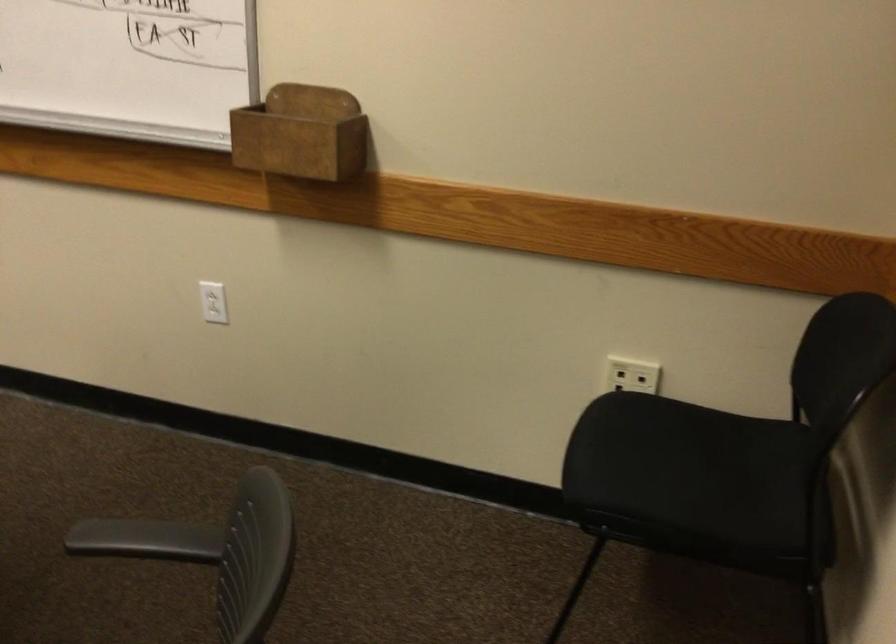
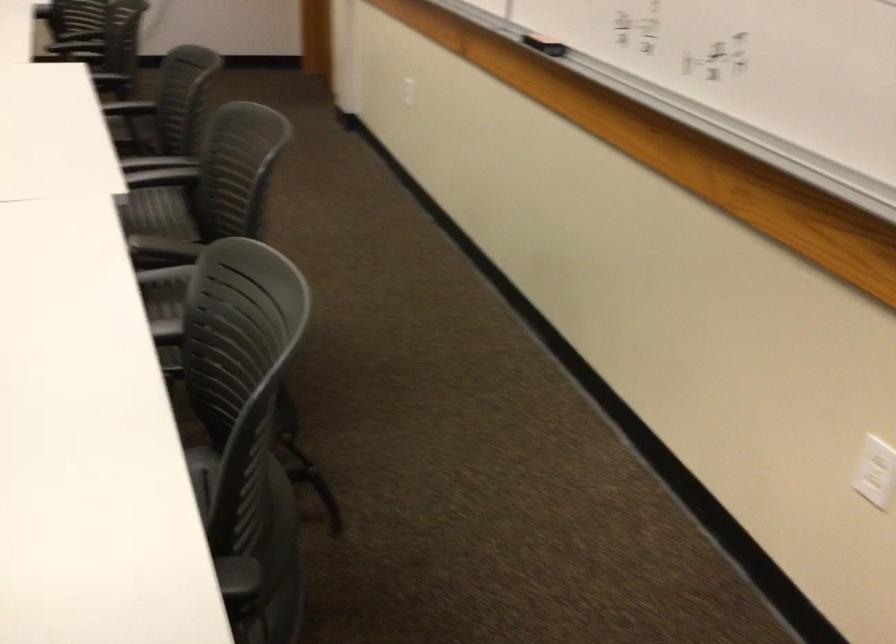
Question: The camera is either moving clockwise (left) or counter-clockwise (right) around the object. The first image is from the beginning of the video and the second image is from the end. Is the camera moving left or right when shooting the video?

Choices:
 (A) Left
 (B) Right

Answer: (B)